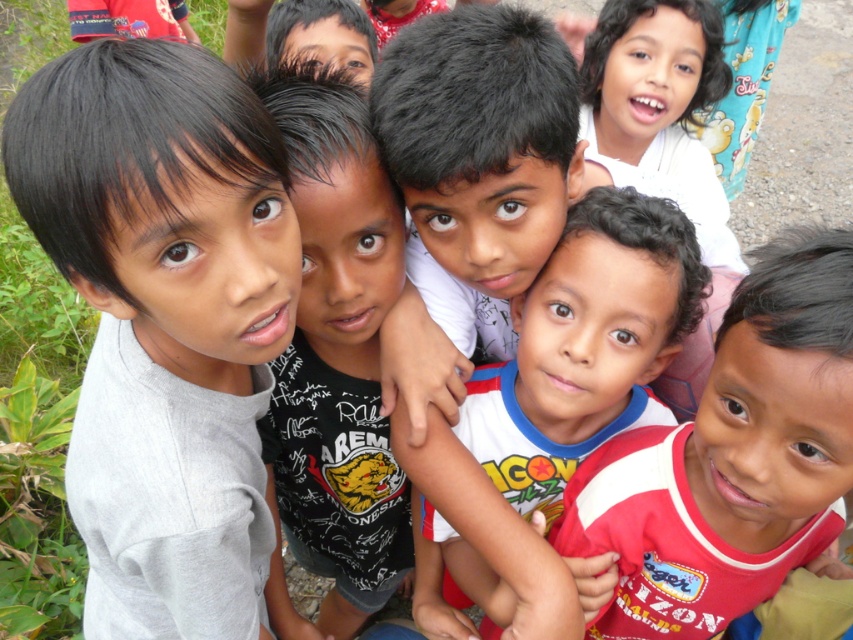
In the scene with the children, there is a gray matte shirt at left and a smooth skin boy at center. Which child is taller?

The gray matte shirt at left is taller than the smooth skin boy at center.

In the scene of children playing outdoors, there are two shirts visible. The gray matte shirt at left and the red cotton shirt at center. Which shirt is positioned lower in the image?

The gray matte shirt at left is below the red cotton shirt at center, so the gray matte shirt at left is positioned lower in the image.